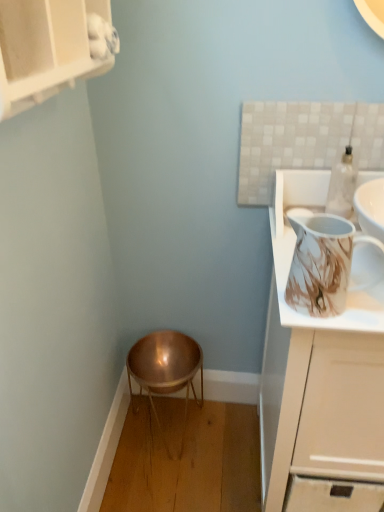
Where is `matte white cabinet at upper left, which is the second cabinetry from bottom to top`? This screenshot has width=384, height=512. matte white cabinet at upper left, which is the second cabinetry from bottom to top is located at coordinates (45, 49).

Locate an element on the screen. This screenshot has width=384, height=512. copper metallic stool at lower center is located at coordinates (165, 370).

Which object is more forward, white glossy cabinet at upper right, the first cabinetry in the bottom-to-top sequence, or matte white cabinet at upper left, the 1th cabinetry from the top?

Positioned in front is matte white cabinet at upper left, the 1th cabinetry from the top.

From the image's perspective, which one is positioned lower, white glossy cabinet at upper right, placed as the second cabinetry when sorted from left to right, or matte white cabinet at upper left, which is the second cabinetry from bottom to top?

white glossy cabinet at upper right, placed as the second cabinetry when sorted from left to right, is shown below in the image.

Which is more to the right, white glossy cabinet at upper right, placed as the second cabinetry when sorted from left to right, or matte white cabinet at upper left, the 1th cabinetry from the top?

white glossy cabinet at upper right, placed as the second cabinetry when sorted from left to right, is more to the right.

Considering the sizes of objects copper metallic stool at lower center and white glossy cabinet at upper right, placed as the second cabinetry when sorted from left to right, in the image provided, who is thinner, copper metallic stool at lower center or white glossy cabinet at upper right, placed as the second cabinetry when sorted from left to right,?

Thinner between the two is copper metallic stool at lower center.

At what (x,y) coordinates should I click in order to perform the action: click on stool behind the white glossy cabinet at upper right, arranged as the 2th cabinetry when viewed from the top. Please return your answer as a coordinate pair (x, y). Image resolution: width=384 pixels, height=512 pixels. Looking at the image, I should click on (165, 370).

Who is smaller, copper metallic stool at lower center or white glossy cabinet at upper right, placed as the second cabinetry when sorted from left to right?

copper metallic stool at lower center.

From the image's perspective, is matte white cabinet at upper left, the 1th cabinetry from the top, above or below copper metallic stool at lower center?

matte white cabinet at upper left, the 1th cabinetry from the top, is above copper metallic stool at lower center.

Is point (46, 89) closer or farther from the camera than point (158, 342)?

Point (46, 89) is closer to the camera than point (158, 342).

From the picture: Is matte white cabinet at upper left, which is the second cabinetry from right to left, oriented away from copper metallic stool at lower center?

No.

Looking at this image, from a real-world perspective, which is physically below, matte white cabinet at upper left, which ranks as the 1th cabinetry in left-to-right order, or copper metallic stool at lower center?

copper metallic stool at lower center, from a real-world perspective.

Is the position of marble-patterned pitcher at upper right more distant than that of matte white cabinet at upper left, which is the second cabinetry from bottom to top?

Yes, marble-patterned pitcher at upper right is further from the viewer.

Consider the image. Is marble-patterned pitcher at upper right turned away from matte white cabinet at upper left, the 1th cabinetry from the top?

No, marble-patterned pitcher at upper right's orientation is not away from matte white cabinet at upper left, the 1th cabinetry from the top.

In the scene shown: Is marble-patterned pitcher at upper right beside matte white cabinet at upper left, the 1th cabinetry from the top?

No, marble-patterned pitcher at upper right is not next to matte white cabinet at upper left, the 1th cabinetry from the top.

Does matte white cabinet at upper left, which is the second cabinetry from bottom to top, have a smaller size compared to marble-patterned pitcher at upper right?

No.

Is matte white cabinet at upper left, the 1th cabinetry from the top, spatially inside marble-patterned pitcher at upper right, or outside of it?

→ matte white cabinet at upper left, the 1th cabinetry from the top, is outside marble-patterned pitcher at upper right.

From a real-world perspective, is matte white cabinet at upper left, the 1th cabinetry from the top, located beneath marble-patterned pitcher at upper right?

No, from a real-world perspective, matte white cabinet at upper left, the 1th cabinetry from the top, is not beneath marble-patterned pitcher at upper right.

Based on the photo, does matte white cabinet at upper left, which is the second cabinetry from bottom to top, turn towards marble-patterned pitcher at upper right?

No, matte white cabinet at upper left, which is the second cabinetry from bottom to top, is not facing towards marble-patterned pitcher at upper right.

From the image's perspective, which is above, copper metallic stool at lower center or marble-patterned pitcher at upper right?

marble-patterned pitcher at upper right is shown above in the image.

Is copper metallic stool at lower center far from marble-patterned pitcher at upper right?

Actually, copper metallic stool at lower center and marble-patterned pitcher at upper right are a little close together.

Between copper metallic stool at lower center and marble-patterned pitcher at upper right, which one has larger width?

copper metallic stool at lower center.

Is white glossy cabinet at upper right, placed as the second cabinetry when sorted from left to right, spatially inside copper metallic stool at lower center, or outside of it?

white glossy cabinet at upper right, placed as the second cabinetry when sorted from left to right, lies outside copper metallic stool at lower center.

Between white glossy cabinet at upper right, arranged as the 2th cabinetry when viewed from the top, and copper metallic stool at lower center, which one appears on the left side from the viewer's perspective?

copper metallic stool at lower center is more to the left.

From a real-world perspective, relative to copper metallic stool at lower center, is white glossy cabinet at upper right, arranged as the 2th cabinetry when viewed from the top, vertically above or below?

In terms of real-world spatial position, white glossy cabinet at upper right, arranged as the 2th cabinetry when viewed from the top, is above copper metallic stool at lower center.

Identify the location of cabinetry located below the matte white cabinet at upper left, which is the second cabinetry from right to left (from the image's perspective). This screenshot has height=512, width=384. (317, 368).

Where is `cabinetry to the right of copper metallic stool at lower center`? This screenshot has height=512, width=384. cabinetry to the right of copper metallic stool at lower center is located at coordinates (317, 368).

From the image, which object appears to be farther from matte white cabinet at upper left, the 1th cabinetry from the top, marble-patterned pitcher at upper right or copper metallic stool at lower center?

Based on the image, copper metallic stool at lower center appears to be further to matte white cabinet at upper left, the 1th cabinetry from the top.

Looking at the image, which one is located closer to copper metallic stool at lower center, marble-patterned pitcher at upper right or white glossy cabinet at upper right, the first cabinetry in the bottom-to-top sequence?

white glossy cabinet at upper right, the first cabinetry in the bottom-to-top sequence, is closer to copper metallic stool at lower center.

Based on the photo, estimate the real-world distances between objects in this image. Which object is further from matte white cabinet at upper left, which ranks as the 1th cabinetry in left-to-right order, white glossy cabinet at upper right, placed as the second cabinetry when sorted from left to right, or copper metallic stool at lower center?

The object further to matte white cabinet at upper left, which ranks as the 1th cabinetry in left-to-right order, is copper metallic stool at lower center.

Looking at the image, which one is located further to white glossy cabinet at upper right, the first cabinetry in the bottom-to-top sequence, marble-patterned pitcher at upper right or copper metallic stool at lower center?

copper metallic stool at lower center.

When comparing their distances from copper metallic stool at lower center, does white glossy cabinet at upper right, the first cabinetry in the bottom-to-top sequence, or matte white cabinet at upper left, which is the second cabinetry from bottom to top, seem closer?

white glossy cabinet at upper right, the first cabinetry in the bottom-to-top sequence, lies closer to copper metallic stool at lower center than the other object.

Based on their spatial positions, is copper metallic stool at lower center or matte white cabinet at upper left, which ranks as the 1th cabinetry in left-to-right order, further from marble-patterned pitcher at upper right?

copper metallic stool at lower center.

Looking at the image, which one is located closer to marble-patterned pitcher at upper right, white glossy cabinet at upper right, arranged as the 2th cabinetry when viewed from the top, or copper metallic stool at lower center?

white glossy cabinet at upper right, arranged as the 2th cabinetry when viewed from the top.

Looking at the image, which one is located further to matte white cabinet at upper left, which ranks as the 1th cabinetry in left-to-right order, copper metallic stool at lower center or marble-patterned pitcher at upper right?

copper metallic stool at lower center.

Identify the location of countertop between white glossy cabinet at upper right, which is the first cabinetry in right-to-left order, and copper metallic stool at lower center from front to back. The width and height of the screenshot is (384, 512). (293, 250).

The height and width of the screenshot is (512, 384). Identify the location of countertop located between matte white cabinet at upper left, the 1th cabinetry from the top, and white glossy cabinet at upper right, the first cabinetry in the bottom-to-top sequence, in the left-right direction. (293, 250).

Identify the location of countertop between matte white cabinet at upper left, which ranks as the 1th cabinetry in left-to-right order, and copper metallic stool at lower center from front to back. (293, 250).

The height and width of the screenshot is (512, 384). I want to click on cabinetry between matte white cabinet at upper left, which is the second cabinetry from bottom to top, and copper metallic stool at lower center in the front-back direction, so click(317, 368).